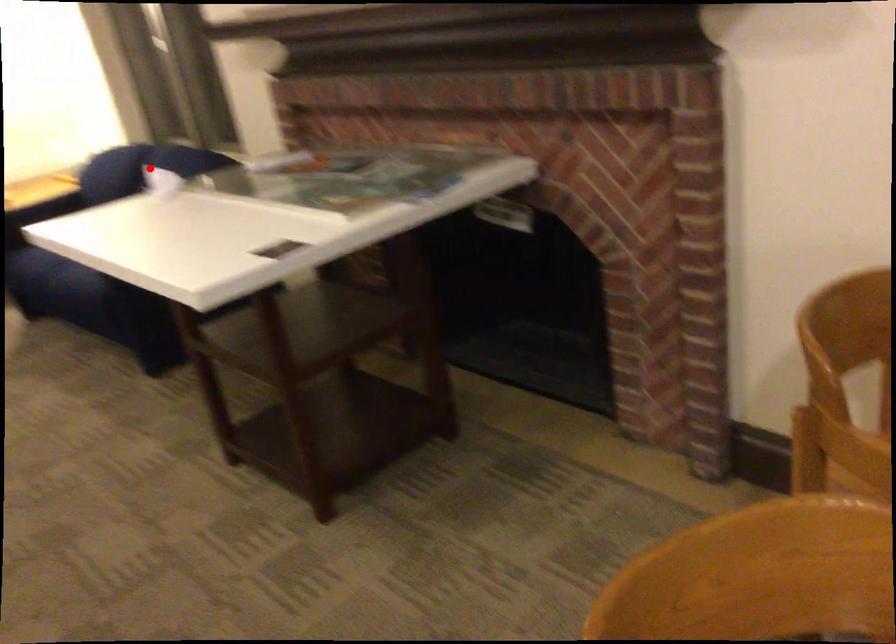
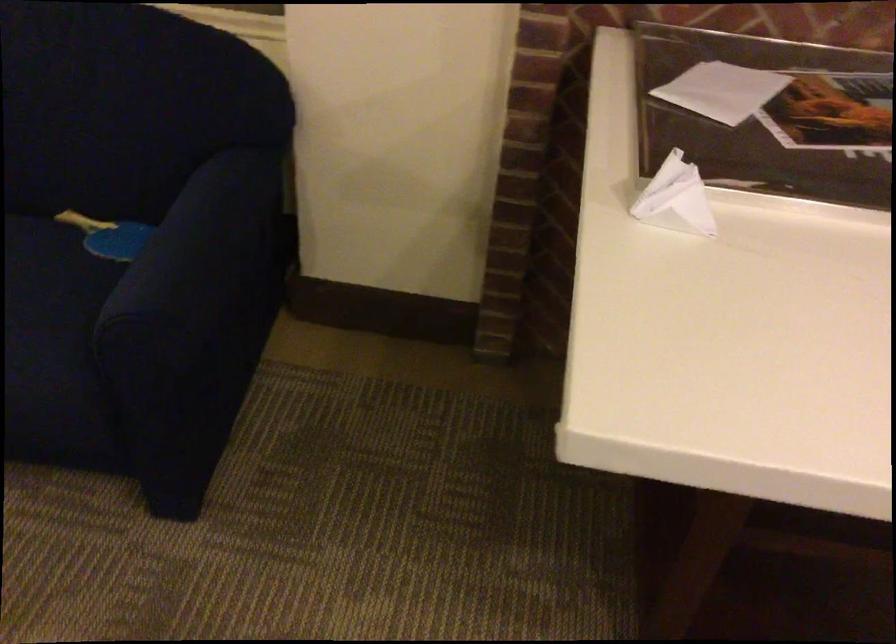
In the second image, find the point that corresponds to the highlighted location in the first image.

(675, 199)